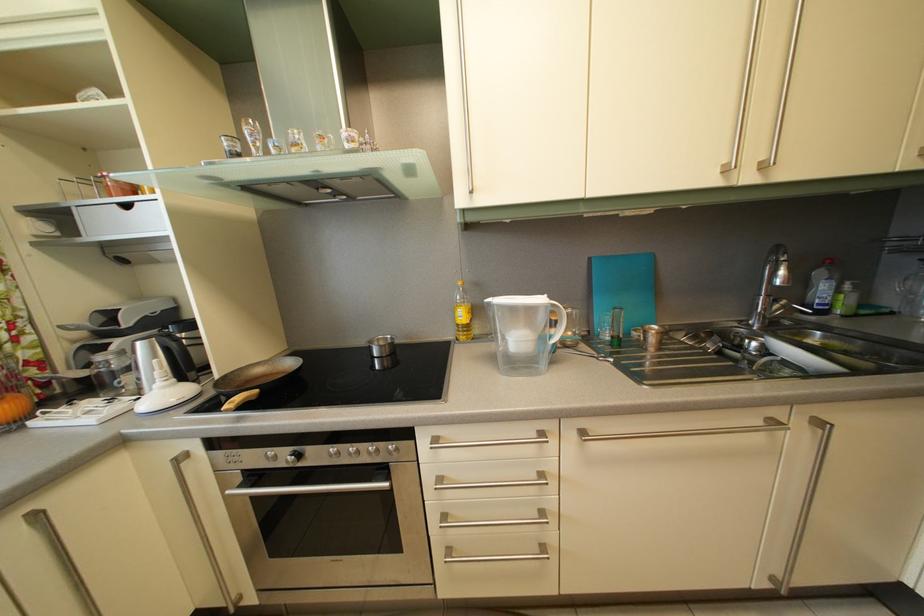
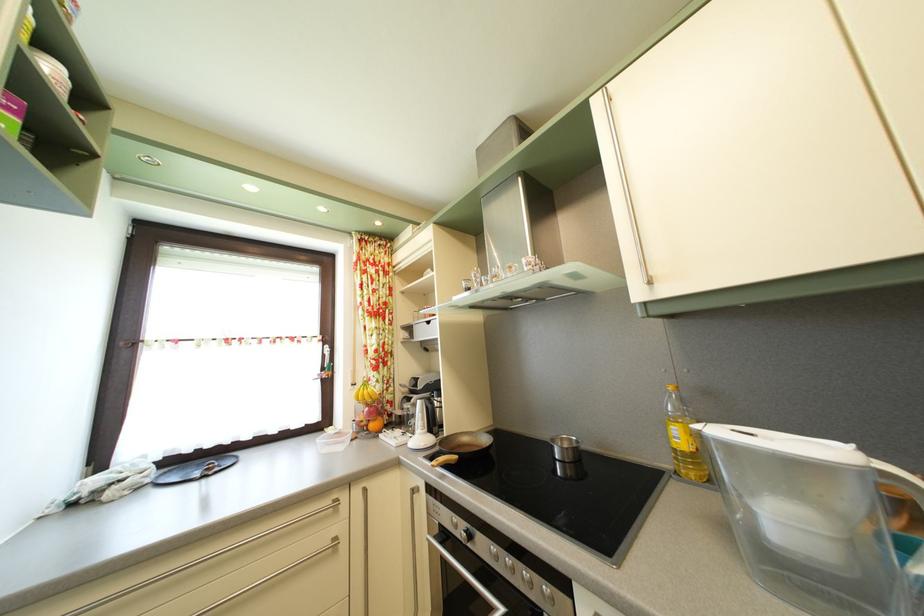
In the second image, find the point that corresponds to the point at 468,291 in the first image.

(678, 395)